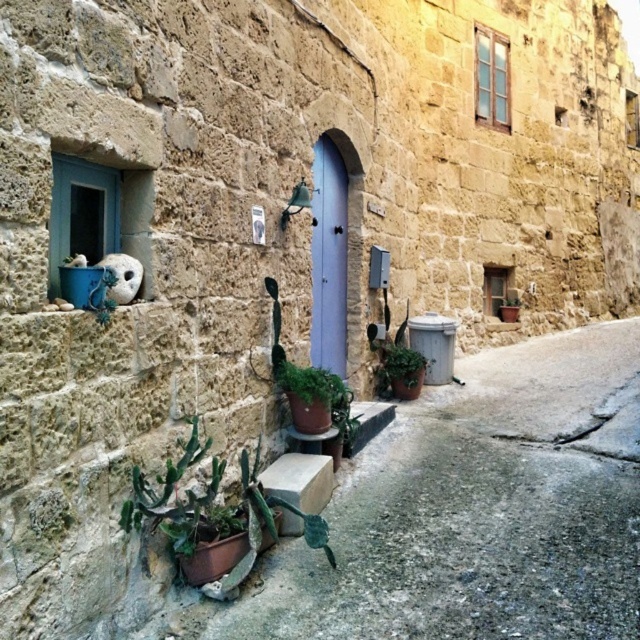
You are a delivery person trying to place a small package on the ledge where the white stone cat at upper left is located. However, the ledge is narrow. Can you estimate if the green succulent at lower left would block the space needed for the package?

The green succulent at lower left might be wider than the white stone cat at upper left, so it could potentially block the space needed for the package. Check the width of the succulent before placing the package.

You are a delivery person trying to place a small package on the ledge below the blue window. The green succulent at lower left and the green matte plant at lower right are already on the ledge. Which plant should you move to make space for the package?

The green succulent at lower left is larger than the green matte plant at lower right, so you should move the smaller green matte plant at lower right to make space for the package.

You are a gardener who wants to arrange plants in order of height from tallest to shortest. Given the green succulent at lower left and the green matte plant at lower right, which one should come first?

The green succulent at lower left should come first because it is taller than the green matte plant at lower right.